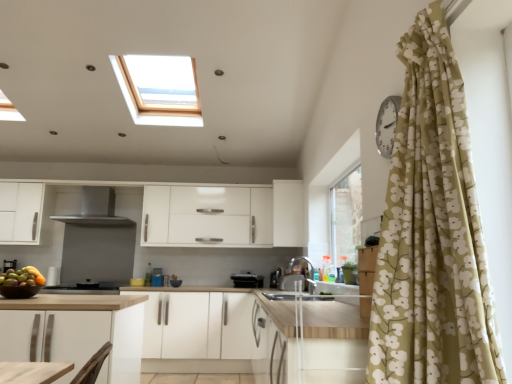
Question: Considering the relative sizes of satin black coffee machine at lower left and satin black toaster at center, which ranks as the sixth appliance in front-to-back order, in the image provided, is satin black coffee machine at lower left shorter than satin black toaster at center, which ranks as the sixth appliance in front-to-back order,?

Choices:
 (A) yes
 (B) no

Answer: (A)

Question: Is satin black coffee machine at lower left wider than satin black toaster at center, which ranks as the sixth appliance in front-to-back order?

Choices:
 (A) no
 (B) yes

Answer: (B)

Question: Is satin black coffee machine at lower left positioned beyond the bounds of satin black toaster at center, the 5th appliance from the top?

Choices:
 (A) yes
 (B) no

Answer: (A)

Question: Considering the relative sizes of satin black coffee machine at lower left and satin black toaster at center, the 2th appliance in the bottom-to-top sequence, in the image provided, is satin black coffee machine at lower left smaller than satin black toaster at center, the 2th appliance in the bottom-to-top sequence,?

Choices:
 (A) no
 (B) yes

Answer: (A)

Question: Is the depth of satin black coffee machine at lower left greater than that of satin black toaster at center, the 5th appliance from the top?

Choices:
 (A) yes
 (B) no

Answer: (B)

Question: From a real-world perspective, relative to satin black toaster at center, which is the first appliance in back-to-front order, is metallic faucet at center, the 2th appliance when ordered from top to bottom, vertically above or below?

Choices:
 (A) below
 (B) above

Answer: (B)

Question: From the image's perspective, is metallic faucet at center, the 2th appliance when ordered from top to bottom, above or below satin black toaster at center, which ranks as the sixth appliance in front-to-back order?

Choices:
 (A) below
 (B) above

Answer: (B)

Question: Is metallic faucet at center, acting as the second appliance starting from the right, bigger or smaller than satin black toaster at center, which is the first appliance in back-to-front order?

Choices:
 (A) small
 (B) big

Answer: (B)

Question: Is metallic faucet at center, which is the 2th appliance from front to back, inside or outside of satin black toaster at center, the 5th appliance from the top?

Choices:
 (A) inside
 (B) outside

Answer: (B)

Question: Considering the positions of silver metallic clock at upper right, positioned as the 6th appliance in back-to-front order, and black plastic toaster at center, marked as the second appliance in a left-to-right arrangement, in the image, is silver metallic clock at upper right, positioned as the 6th appliance in back-to-front order, bigger or smaller than black plastic toaster at center, marked as the second appliance in a left-to-right arrangement,?

Choices:
 (A) small
 (B) big

Answer: (A)

Question: In the image, is silver metallic clock at upper right, the 6th appliance positioned from the bottom, positioned in front of or behind black plastic toaster at center, marked as the second appliance in a left-to-right arrangement?

Choices:
 (A) front
 (B) behind

Answer: (A)

Question: Looking at their shapes, would you say silver metallic clock at upper right, the first appliance from the right, is wider or thinner than black plastic toaster at center, which appears as the third appliance when ordered from the bottom?

Choices:
 (A) thin
 (B) wide

Answer: (A)

Question: From the image's perspective, relative to black plastic toaster at center, the second appliance positioned from the back, is silver metallic clock at upper right, arranged as the 1th appliance when viewed from the top, above or below?

Choices:
 (A) above
 (B) below

Answer: (A)

Question: Considering the positions of satin black coffee machine at lower left and satin black toaster at center, which is the first appliance in back-to-front order, in the image, is satin black coffee machine at lower left taller or shorter than satin black toaster at center, which is the first appliance in back-to-front order,?

Choices:
 (A) tall
 (B) short

Answer: (B)

Question: From the image's perspective, is satin black coffee machine at lower left positioned above or below satin black toaster at center, which is the first appliance in back-to-front order?

Choices:
 (A) above
 (B) below

Answer: (A)